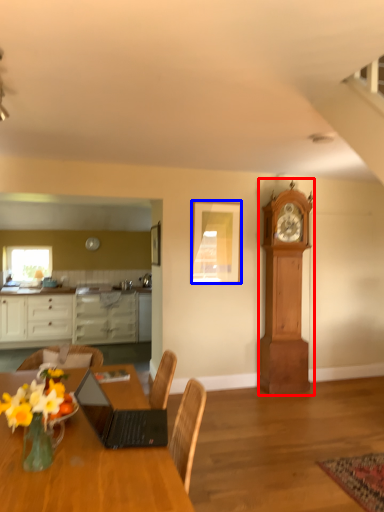
Question: Which object is closer to the camera taking this photo, clock (highlighted by a red box) or picture frame (highlighted by a blue box)?

Choices:
 (A) clock
 (B) picture frame

Answer: (A)